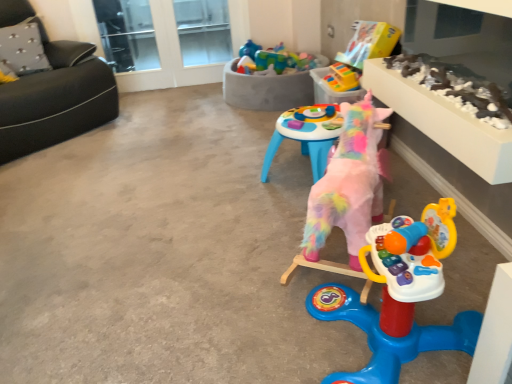
Question: Should I look upward or downward to see transparent glass window at upper center?

Choices:
 (A) up
 (B) down

Answer: (A)

Question: Is transparent glass window at upper center positioned far away from rubberized plastic toy at upper center, arranged as the 4th toy when viewed from the front?

Choices:
 (A) yes
 (B) no

Answer: (A)

Question: Is transparent glass window at upper center wider than rubberized plastic toy at upper center, arranged as the 4th toy when viewed from the front?

Choices:
 (A) no
 (B) yes

Answer: (A)

Question: From the image's perspective, does transparent glass window at upper center appear higher than rubberized plastic toy at upper center, which is the 2th toy in back-to-front order?

Choices:
 (A) no
 (B) yes

Answer: (B)

Question: From a real-world perspective, is transparent glass window at upper center beneath rubberized plastic toy at upper center, arranged as the 4th toy when viewed from the front?

Choices:
 (A) no
 (B) yes

Answer: (B)

Question: Is transparent glass window at upper center placed right next to rubberized plastic toy at upper center, which is the 2th toy in back-to-front order?

Choices:
 (A) yes
 (B) no

Answer: (B)

Question: Is transparent glass window at upper center outside of rubberized plastic toy at upper center, which is the 2th toy in back-to-front order?

Choices:
 (A) no
 (B) yes

Answer: (B)

Question: Would you consider gray fabric pillow at upper left to be distant from plush pink unicorn at center, arranged as the fifth toy when viewed from the back?

Choices:
 (A) yes
 (B) no

Answer: (A)

Question: Considering the relative sizes of gray fabric pillow at upper left and plush pink unicorn at center, arranged as the fifth toy when viewed from the back, in the image provided, is gray fabric pillow at upper left taller than plush pink unicorn at center, arranged as the fifth toy when viewed from the back,?

Choices:
 (A) no
 (B) yes

Answer: (A)

Question: Is gray fabric pillow at upper left wider than plush pink unicorn at center, arranged as the fifth toy when viewed from the back?

Choices:
 (A) yes
 (B) no

Answer: (B)

Question: Is gray fabric pillow at upper left bigger than plush pink unicorn at center, arranged as the fifth toy when viewed from the back?

Choices:
 (A) no
 (B) yes

Answer: (A)

Question: Does gray fabric pillow at upper left lie behind plush pink unicorn at center, the 1th toy positioned from the front?

Choices:
 (A) yes
 (B) no

Answer: (A)

Question: Can you confirm if gray fabric pillow at upper left is shorter than plush pink unicorn at center, arranged as the fifth toy when viewed from the back?

Choices:
 (A) no
 (B) yes

Answer: (B)

Question: Is transparent glass door at upper center not close to multicolored plastic toy at upper center, acting as the 3th toy starting from the front?

Choices:
 (A) yes
 (B) no

Answer: (A)